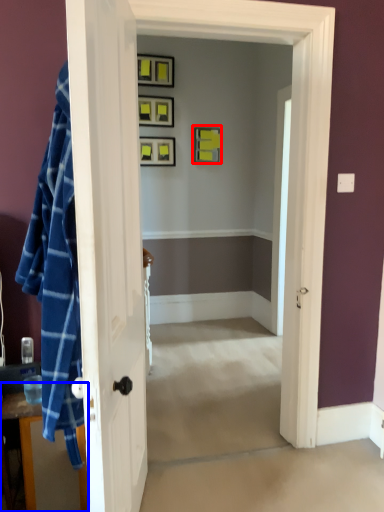
Question: Which point is further to the camera, picture frame (highlighted by a red box) or dresser (highlighted by a blue box)?

Choices:
 (A) picture frame
 (B) dresser

Answer: (A)